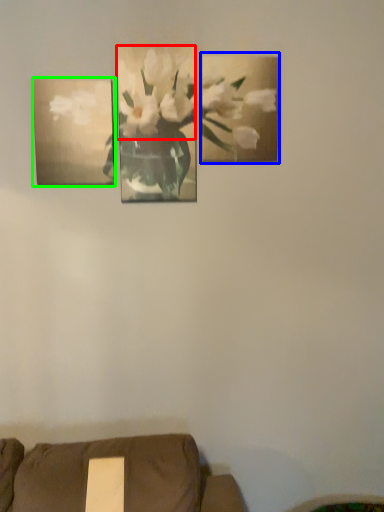
Question: Based on their relative distances, which object is farther from flower (highlighted by a red box)? Choose from picture frame (highlighted by a blue box) and picture frame (highlighted by a green box).

Choices:
 (A) picture frame
 (B) picture frame

Answer: (B)